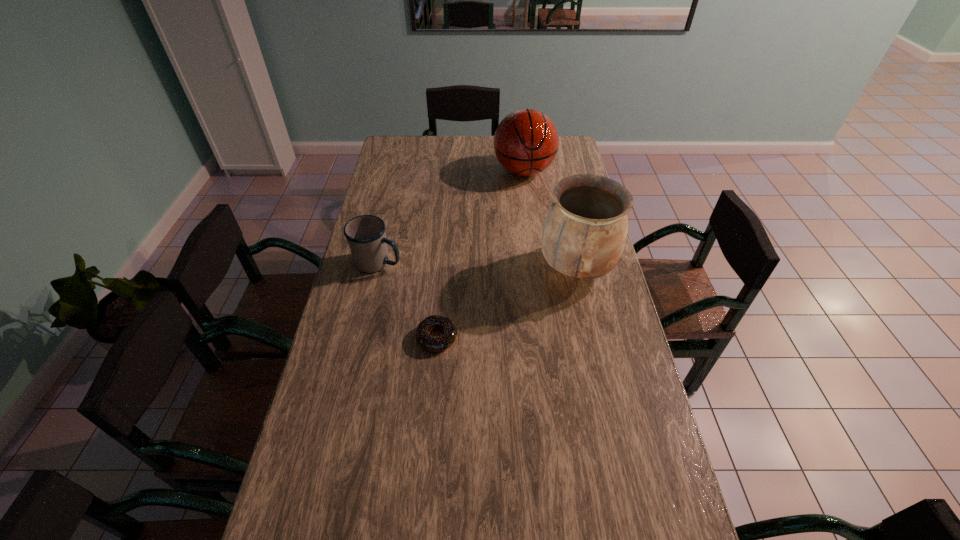
At what (x,y) coordinates should I click in order to perform the action: click on vacant area at the left edge of the desktop. Please return your answer as a coordinate pair (x, y). The width and height of the screenshot is (960, 540). Looking at the image, I should click on (383, 206).

Where is `free space at the right edge`? The image size is (960, 540). free space at the right edge is located at coordinates (622, 489).

At what (x,y) coordinates should I click in order to perform the action: click on vacant point at the far left corner. Please return your answer as a coordinate pair (x, y). This screenshot has width=960, height=540. Looking at the image, I should click on (387, 155).

The width and height of the screenshot is (960, 540). Find the location of `blank area at the near left corner`. blank area at the near left corner is located at coordinates (336, 526).

Identify the location of free space at the far right corner of the desktop. (564, 153).

Find the location of a particular element. This screenshot has width=960, height=540. free space between the doughnut and the urn is located at coordinates (507, 303).

Where is `free space between the second object from left to right and the third tallest object`? The width and height of the screenshot is (960, 540). free space between the second object from left to right and the third tallest object is located at coordinates (408, 300).

This screenshot has width=960, height=540. I want to click on free space between the mug and the basketball, so click(x=451, y=217).

The image size is (960, 540). I want to click on free space between the urn and the third object from right to left, so click(x=507, y=303).

Identify the location of free area in between the second shortest object and the basketball. The image size is (960, 540). (451, 217).